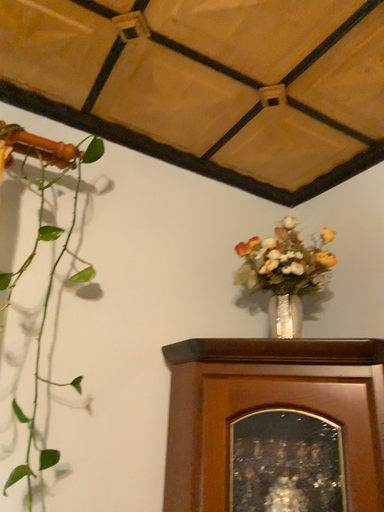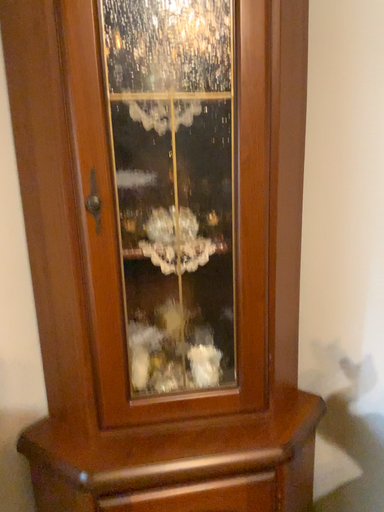
Question: How did the camera likely rotate when shooting the video?

Choices:
 (A) rotated downward
 (B) rotated upward

Answer: (A)